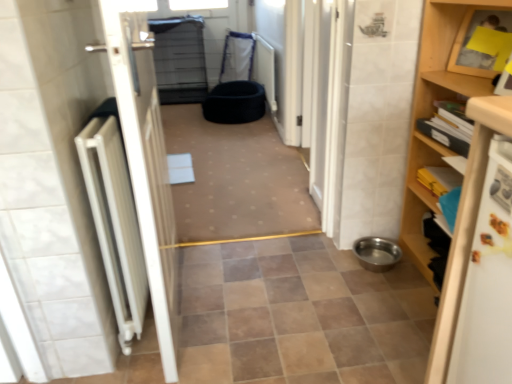
Question: Considering the relative sizes of metallic stainless steel bowl at lower right, the first toilet bowl in the front-to-back sequence, and black fabric pet bed at center in the image provided, is metallic stainless steel bowl at lower right, the first toilet bowl in the front-to-back sequence, thinner than black fabric pet bed at center?

Choices:
 (A) no
 (B) yes

Answer: (B)

Question: Can you confirm if metallic stainless steel bowl at lower right, arranged as the 2th toilet bowl when viewed from the top, is bigger than black fabric pet bed at center?

Choices:
 (A) no
 (B) yes

Answer: (A)

Question: Is metallic stainless steel bowl at lower right, which is the second toilet bowl from back to front, oriented towards black fabric pet bed at center?

Choices:
 (A) yes
 (B) no

Answer: (B)

Question: Can you confirm if metallic stainless steel bowl at lower right, arranged as the first toilet bowl when ordered from the bottom, is taller than black fabric pet bed at center?

Choices:
 (A) no
 (B) yes

Answer: (B)

Question: Is black fabric pet bed at center at the back of metallic stainless steel bowl at lower right, arranged as the first toilet bowl when ordered from the bottom?

Choices:
 (A) no
 (B) yes

Answer: (A)

Question: From the image's perspective, is metallic stainless steel bowl at lower right, arranged as the 2th toilet bowl when viewed from the top, under black fabric pet bed at center?

Choices:
 (A) no
 (B) yes

Answer: (B)

Question: Can you confirm if white matte door at left is smaller than wooden shelf at right?

Choices:
 (A) yes
 (B) no

Answer: (A)

Question: Can you confirm if white matte door at left is thinner than wooden shelf at right?

Choices:
 (A) yes
 (B) no

Answer: (A)

Question: From a real-world perspective, is white matte door at left physically above wooden shelf at right?

Choices:
 (A) yes
 (B) no

Answer: (A)

Question: Could you tell me if white matte door at left is turned towards wooden shelf at right?

Choices:
 (A) yes
 (B) no

Answer: (A)

Question: Does white matte door at left have a lesser height compared to wooden shelf at right?

Choices:
 (A) yes
 (B) no

Answer: (B)

Question: From the image's perspective, is white matte door at left under wooden shelf at right?

Choices:
 (A) yes
 (B) no

Answer: (A)

Question: Does black fabric pet bed at center, the 2th toilet bowl positioned from the right, have a smaller size compared to wooden shelf at right?

Choices:
 (A) no
 (B) yes

Answer: (B)